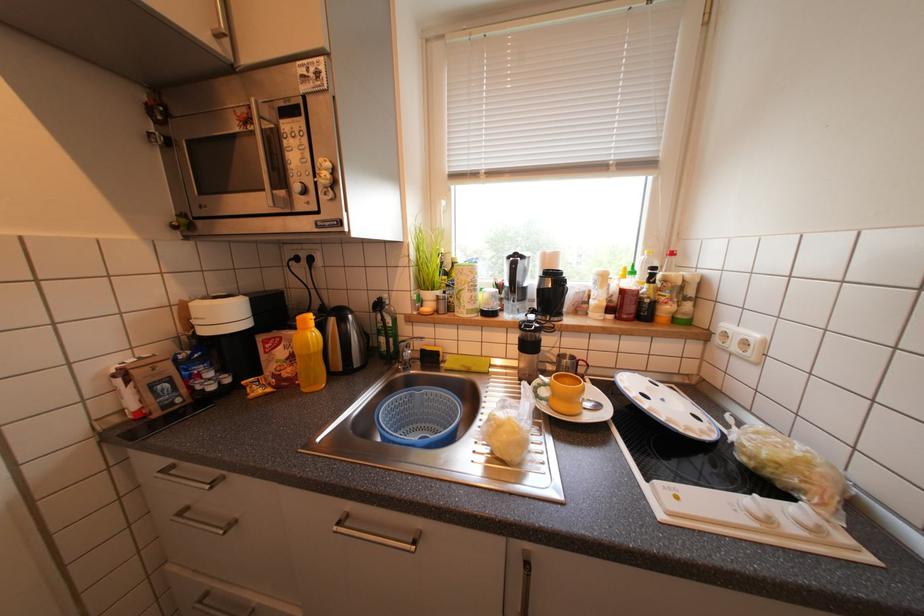
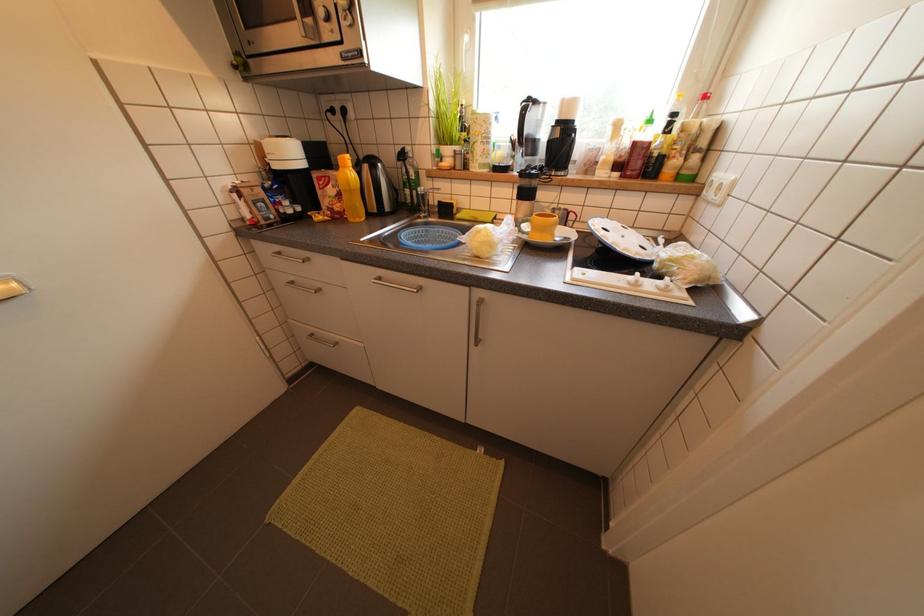
Question: Based on the continuous images, in which direction is the camera rotating? Reply with the corresponding letter.

Choices:
 (A) Left
 (B) Right
 (C) Up
 (D) Down

Answer: (D)